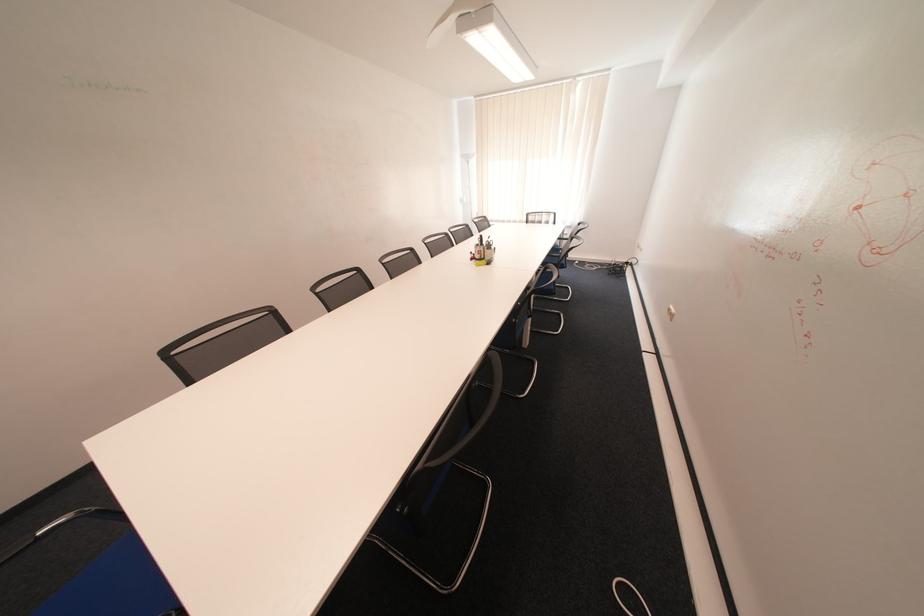
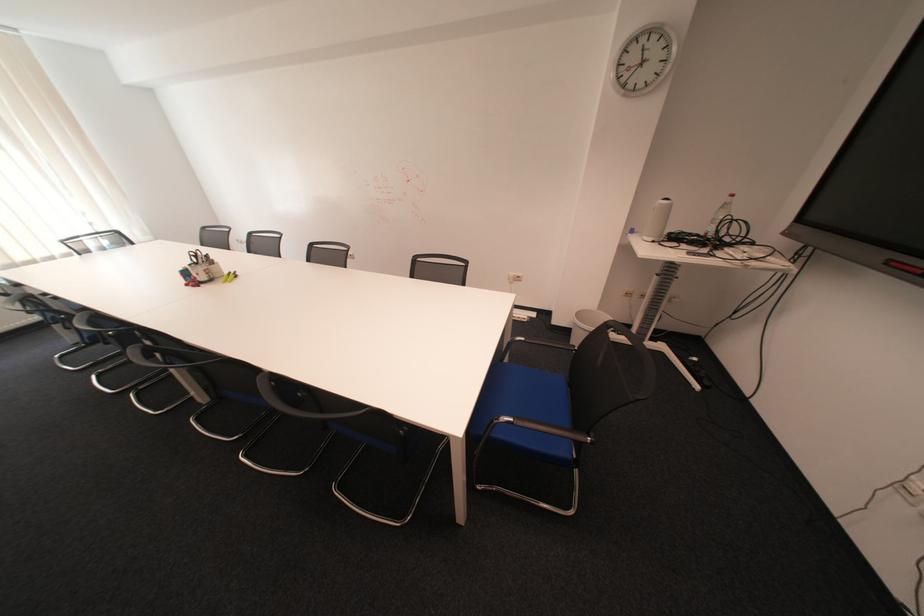
Find the pixel in the second image that matches [492,260] in the first image.

(223, 281)